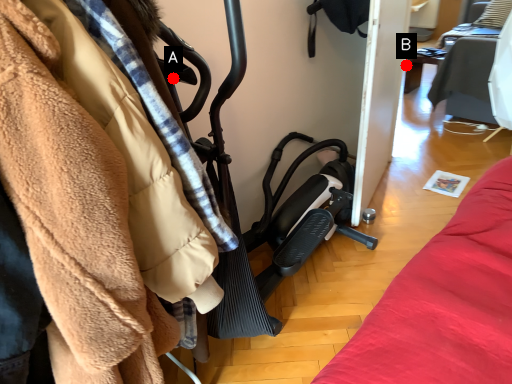
Question: Two points are circled on the image, labeled by A and B beside each circle. Which point is farther from the camera taking this photo?

Choices:
 (A) A is further
 (B) B is further

Answer: (B)